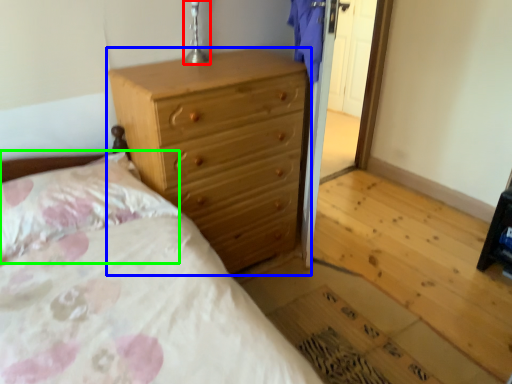
Question: Considering the real-world distances, which object is farthest from table lamp (highlighted by a red box)? chest of drawers (highlighted by a blue box) or pillow (highlighted by a green box)?

Choices:
 (A) chest of drawers
 (B) pillow

Answer: (B)